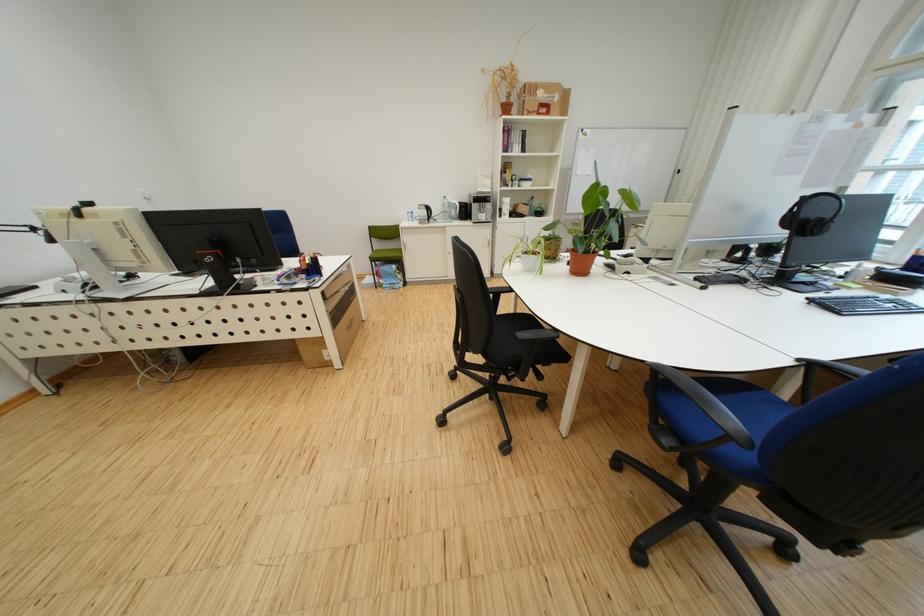
I want to click on blue chair sitting surface, so click(748, 405).